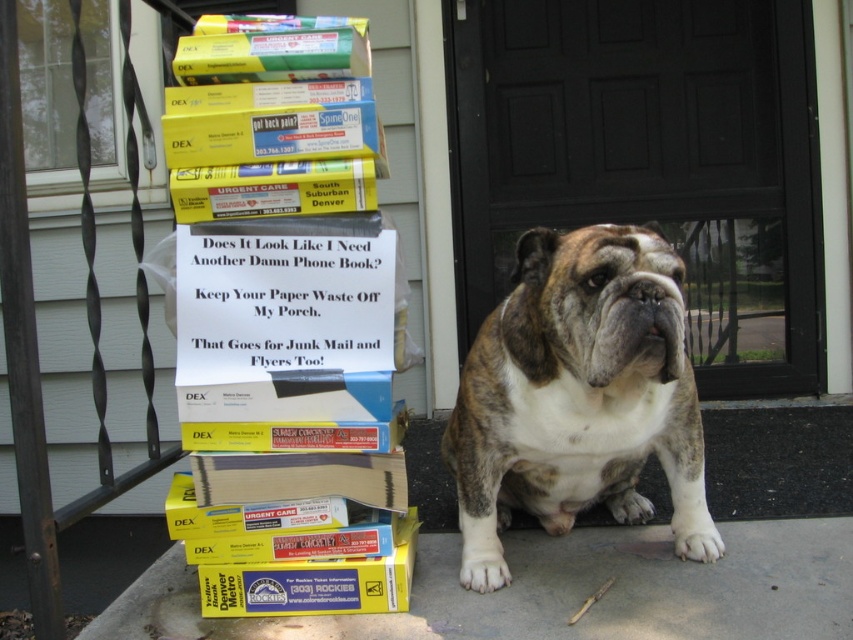
Question: From the image, what is the correct spatial relationship of brown/white fur at center in relation to brown fur at center?

Choices:
 (A) above
 (B) below

Answer: (B)

Question: Which point is farther to the camera?

Choices:
 (A) (332, 467)
 (B) (471, 584)
 (C) (407, 582)
 (D) (610, 246)

Answer: (B)

Question: Which object is farther from the camera taking this photo?

Choices:
 (A) brown/white fur at center
 (B) yellow paper sign at center
 (C) yellow matte box at lower left

Answer: (C)

Question: Which point is farther to the camera?

Choices:
 (A) (552, 259)
 (B) (403, 584)

Answer: (B)

Question: Can you confirm if yellow paper sign at center is wider than yellow matte box at lower left?

Choices:
 (A) no
 (B) yes

Answer: (B)

Question: Does yellow paper sign at center appear on the right side of yellow matte box at lower left?

Choices:
 (A) yes
 (B) no

Answer: (B)